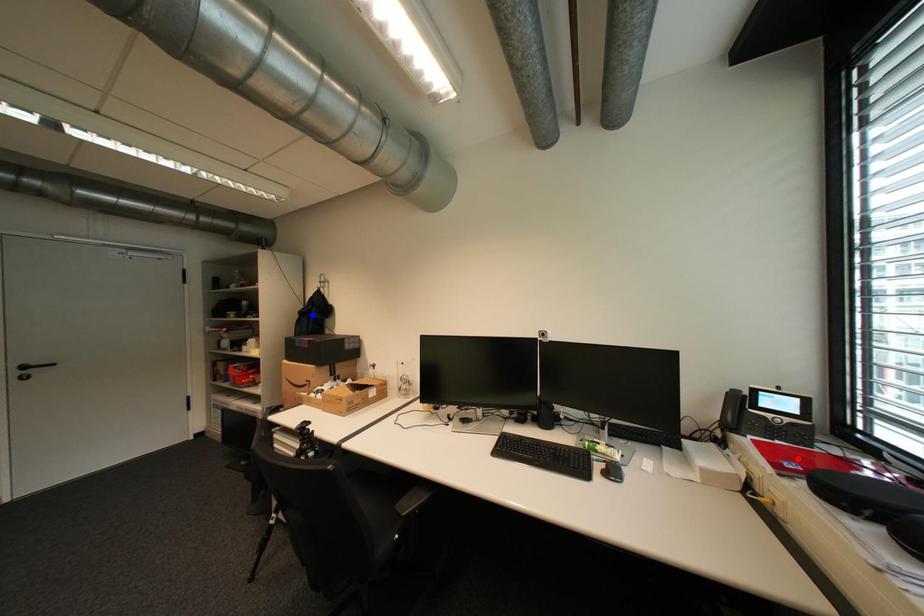
Question: Which of the two points in the image is closer to the camera?

Choices:
 (A) Blue point is closer.
 (B) Red point is closer.

Answer: (B)